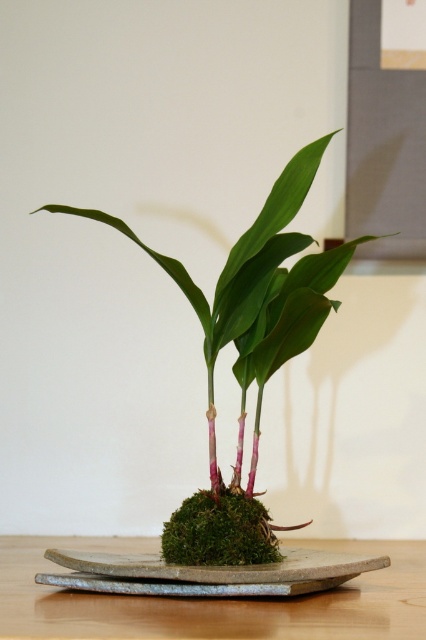
You are an interior designer assessing the placement of the green mossy plant at center and the green moss at center. Which object appears closer to you in the image?

The green mossy plant at center is closer to the viewer than the green moss at center.

You are a gardener who wants to water the green mossy plant at center and the gray stone tray at center. Which one should you water first if you want to avoid getting water on the other?

You should water the green mossy plant at center first because it is closer to you than the gray stone tray at center. Watering the plant first will prevent water from dripping onto the tray below.

You are looking at the minimalist plant arrangement. There are two points marked in the image. Which point is closer to you, point (x=66, y=545) or point (x=339, y=563)?

Point (x=66, y=545) is further to the camera than point (x=339, y=563), so point (x=339, y=563) is closer to you.